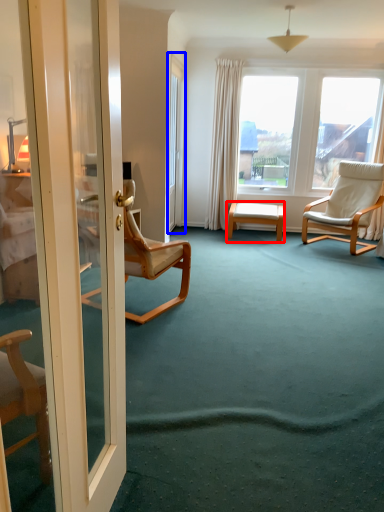
Question: Which object appears closest to the camera in this image, table (highlighted by a red box) or glass door (highlighted by a blue box)?

Choices:
 (A) table
 (B) glass door

Answer: (B)